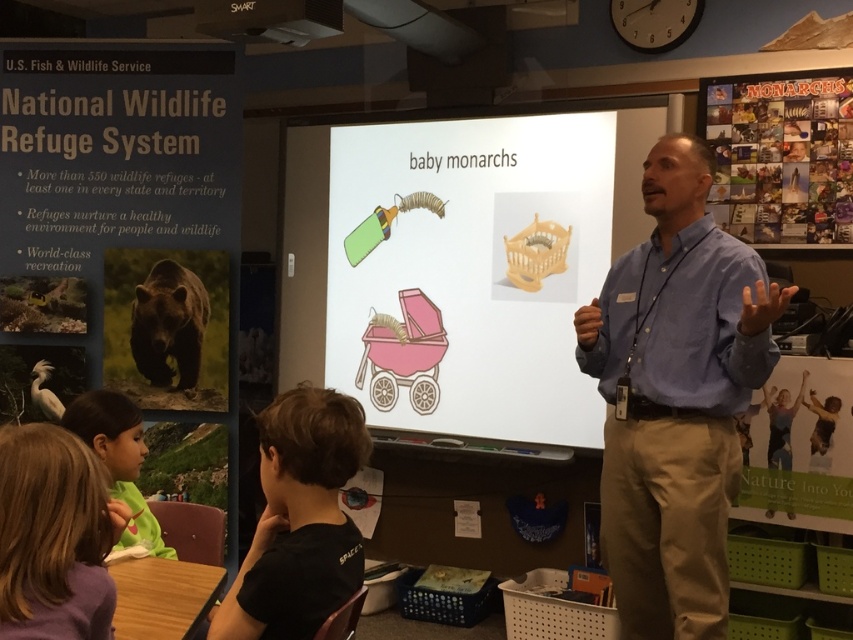
You are a photographer standing 2 meters away from the camera. You want to take a photo of the multicolored collage at upper right. Is the camera within your reach to use?

The multicolored collage at upper right and camera are 3.20 meters apart. Since you are 2 meters away from the camera, the distance between you and the multicolored collage at upper right would be 5.20 meters. Therefore, the camera is not within your reach to take a photo of the multicolored collage at upper right.

You are an observer in the room. You see the blue shirt at center and the smooth brown hair at lower left. Which object is higher up in the image?

The blue shirt at center is taller than smooth brown hair at lower left, so the blue shirt at center is higher up in the image.

Based on the photo, you are a photographer trying to capture a photo of the blue shirt at center and the black cotton shirt at lower left. Which shirt should you focus on first if you want to include both in your frame without moving the camera?

The black cotton shirt at lower left should be focused on first because the blue shirt at center is to the right of it, so adjusting focus from left to right would naturally include both in the frame.